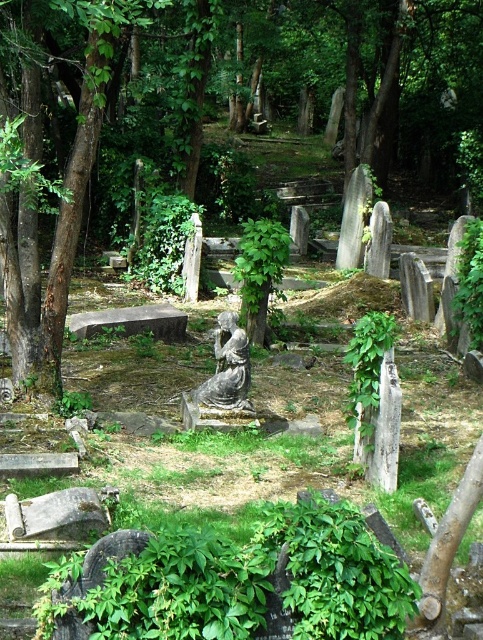
You are a gardener trying to maintain the cemetery. You need to water the brown wood tree at center and the gray stone statue at center. Which one should you water first if you want to start from the left side of the statue?

You should water the gray stone statue at center first because the brown wood tree at center is positioned on the right side of the gray stone statue at center, so the statue is on the left.

You are a gardener trying to plant a new flower bed between the brown wood tree at center and the gray stone statue at center. Based on their widths, which object should you place the flowers closer to to ensure they have enough space?

The brown wood tree at center might be wider than the gray stone statue at center, so you should place the flowers closer to the gray stone statue at center to ensure they have enough space.

You are standing at the point marked by the coordinates (233, 116) in the cemetery. What object is located exactly at this point?

The point marked by the coordinates (233, 116) is exactly where the brown wood tree at center is located.